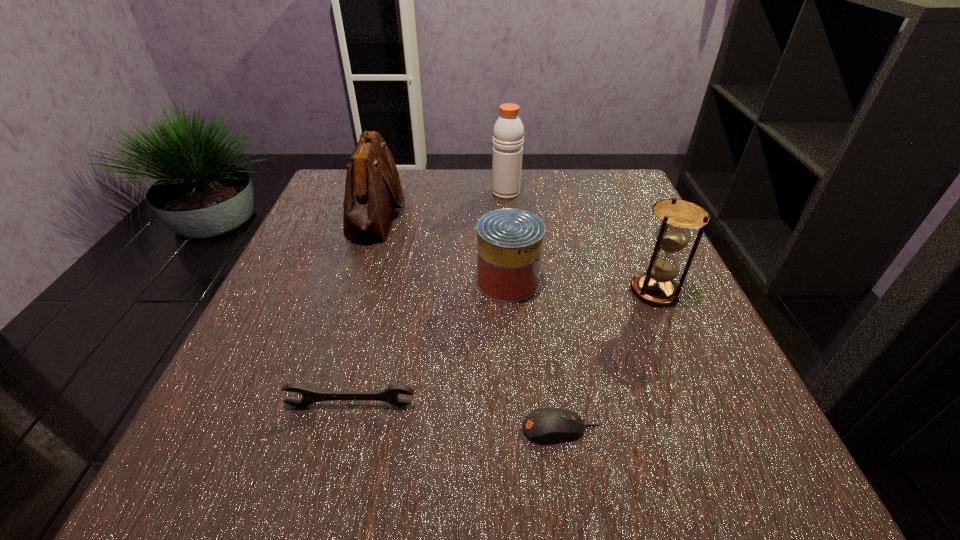
The image size is (960, 540). I want to click on object present at the far left corner, so click(372, 189).

The height and width of the screenshot is (540, 960). In the image, there is a desktop. Find the location of `free space at the far edge`. free space at the far edge is located at coordinates (485, 196).

In the image, there is a desktop. Identify the location of vacant space at the near edge. (369, 456).

Locate an element on the screen. vacant space at the left edge of the desktop is located at coordinates (312, 289).

What are the coordinates of `vacant space at the right edge` in the screenshot? It's located at (655, 234).

Find the location of a particular element. vacant space at the near left corner is located at coordinates tap(163, 491).

The width and height of the screenshot is (960, 540). I want to click on free space at the far right corner, so click(611, 202).

Image resolution: width=960 pixels, height=540 pixels. I want to click on vacant space at the near right corner of the desktop, so point(669,481).

The image size is (960, 540). I want to click on free spot between the computer mouse and the hourglass, so click(x=608, y=360).

You are a GUI agent. You are given a task and a screenshot of the screen. Output one action in this format:
    pyautogui.click(x=<x>, y=<y>)
    Task: Click on the free space between the third shortest object and the second shortest object
    The width and height of the screenshot is (960, 540).
    Given the screenshot: What is the action you would take?
    pyautogui.click(x=429, y=343)